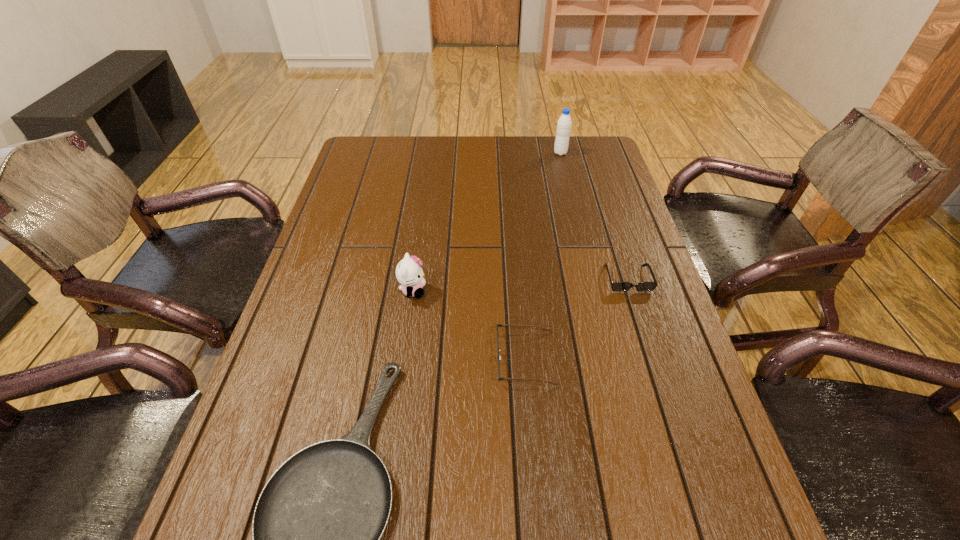
You are a GUI agent. You are given a task and a screenshot of the screen. Output one action in this format:
    pyautogui.click(x=<x>, y=<y>)
    Task: Click on the vacant area that lies between the third object from left to right and the tallest object
    
    Given the screenshot: What is the action you would take?
    pyautogui.click(x=543, y=255)

In order to click on vacant point located between the spectacles and the sunglasses in this screenshot , I will do `click(577, 318)`.

The width and height of the screenshot is (960, 540). Find the location of `free space between the farthest object and the kitten`. free space between the farthest object and the kitten is located at coordinates (487, 222).

Locate an element on the screen. free space that is in between the kitten and the rightmost object is located at coordinates (520, 285).

Find the location of a particular element. vacant space that is in between the farthest object and the third object from right to left is located at coordinates (543, 255).

This screenshot has height=540, width=960. In order to click on free point between the third object from left to right and the rightmost object in this screenshot , I will do `click(577, 318)`.

Identify the location of free space between the fourth shortest object and the sunglasses. The width and height of the screenshot is (960, 540). (520, 285).

This screenshot has width=960, height=540. Find the location of `the third closest object to the second object from right to left`. the third closest object to the second object from right to left is located at coordinates (503, 325).

Find the location of `object that is the fourth closest to the spectacles`. object that is the fourth closest to the spectacles is located at coordinates (564, 123).

Where is `vacant space that satisfies the following two spatial constraints: 1. on the front-facing side of the sunglasses; 2. on the front-facing side of the kitten`? This screenshot has height=540, width=960. vacant space that satisfies the following two spatial constraints: 1. on the front-facing side of the sunglasses; 2. on the front-facing side of the kitten is located at coordinates (632, 291).